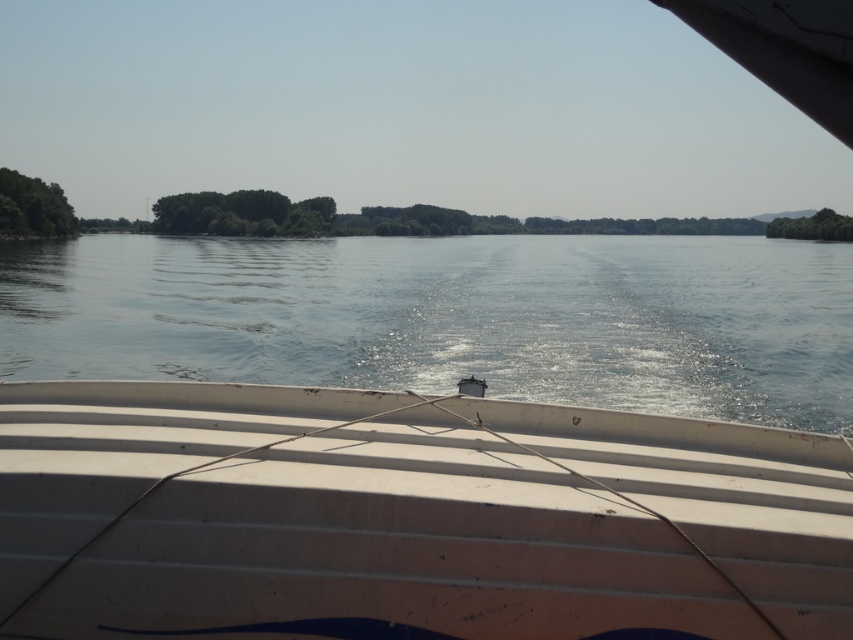
Is the position of white corrugated plastic boat at center more distant than that of clear blue water at center?

No, it is not.

Looking at this image, does white corrugated plastic boat at center appear over clear blue water at center?

No.

What do you see at coordinates (408, 518) in the screenshot? The height and width of the screenshot is (640, 853). I see `white corrugated plastic boat at center` at bounding box center [408, 518].

Where is `white corrugated plastic boat at center`? The width and height of the screenshot is (853, 640). white corrugated plastic boat at center is located at coordinates (408, 518).